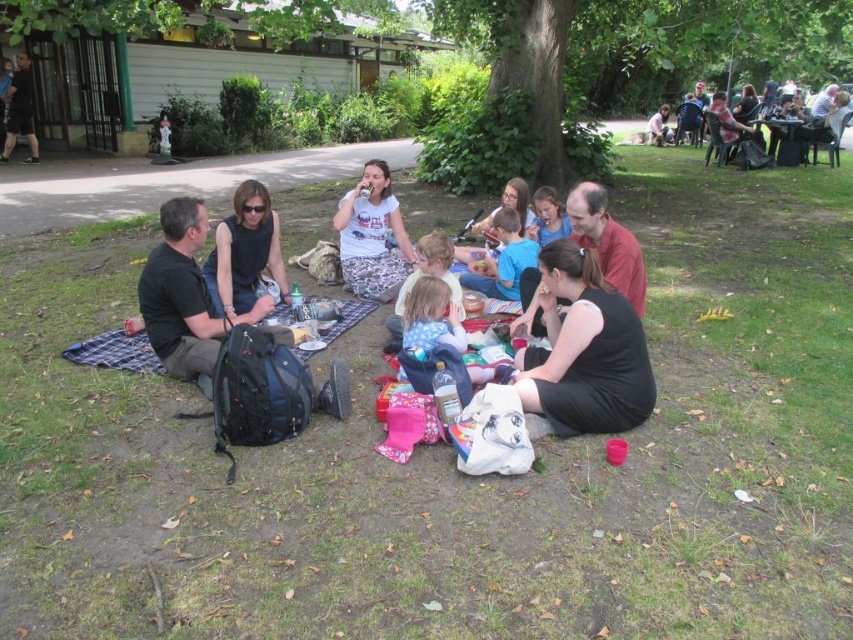
Question: Estimate the real-world distances between objects in this image. Which object is farther from the matte black table at upper right?

Choices:
 (A) black sleeveless top at center
 (B) matte black backpack at lower left
 (C) white cotton t-shirt at center

Answer: (A)

Question: Where is white cotton t-shirt at center located in relation to matte black table at upper right in the image?

Choices:
 (A) below
 (B) above

Answer: (A)

Question: Which point is farther to the camera?

Choices:
 (A) black sleeveless top at center
 (B) matte black table at upper right
 (C) matte black backpack at lower left

Answer: (B)

Question: Which point is farther to the camera?

Choices:
 (A) black sleeveless top at center
 (B) matte black table at upper right

Answer: (B)

Question: Does matte black backpack at lower left appear over matte black table at upper right?

Choices:
 (A) no
 (B) yes

Answer: (A)

Question: Can you confirm if black sleeveless top at center is positioned below matte black table at upper right?

Choices:
 (A) no
 (B) yes

Answer: (B)